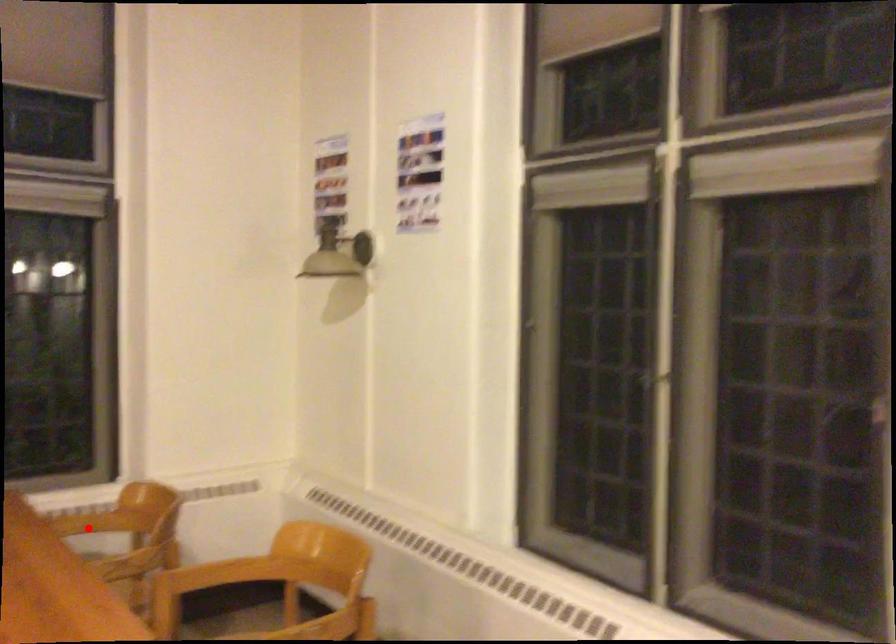
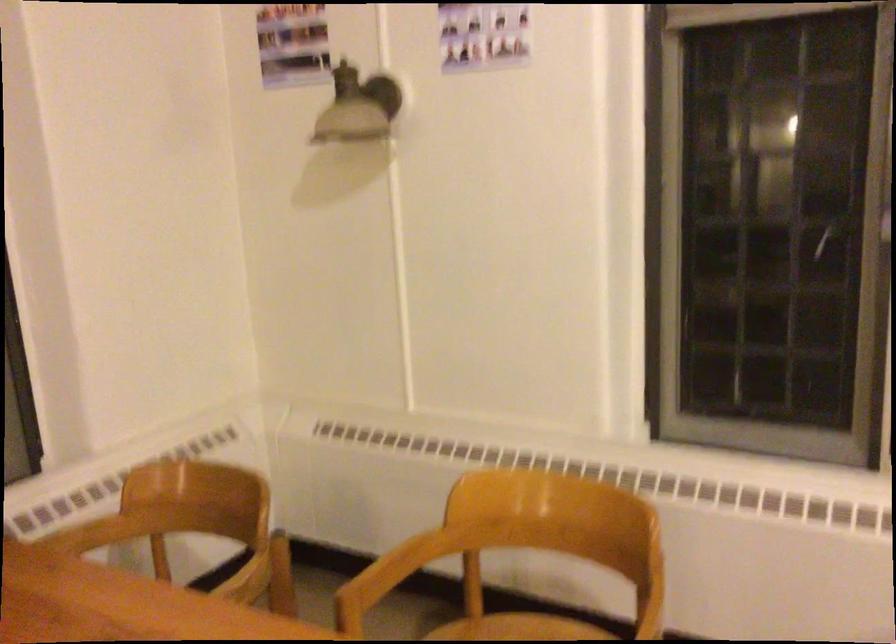
Where in the second image is the point corresponding to the highlighted location from the first image?

(92, 534)